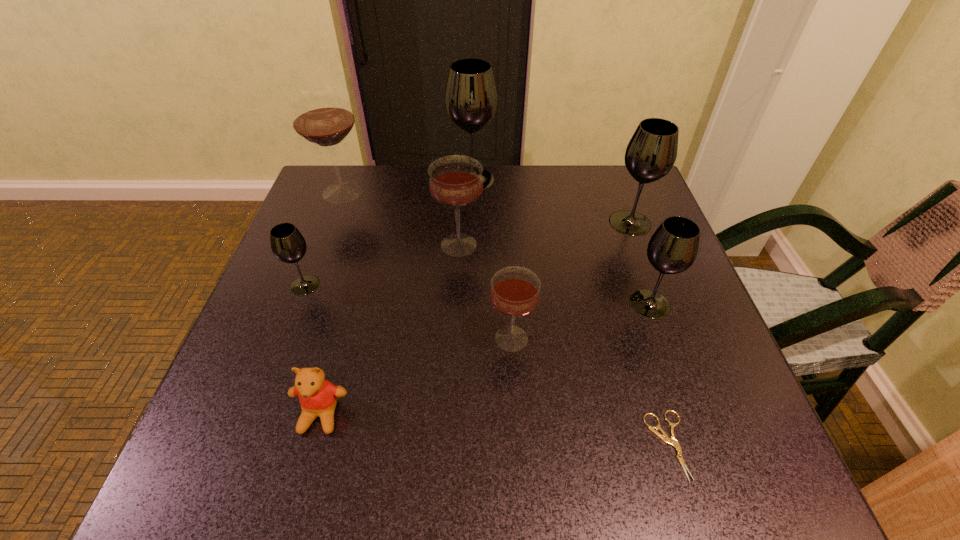
This screenshot has width=960, height=540. What are the coordinates of `object that is at the near right corner` in the screenshot? It's located at click(x=672, y=441).

Locate an element on the screen. The image size is (960, 540). free location at the far edge is located at coordinates (423, 170).

In the image, there is a desktop. Find the location of `vacant space at the near edge`. vacant space at the near edge is located at coordinates (415, 447).

Locate an element on the screen. vacant region at the left edge of the desktop is located at coordinates (238, 380).

Identify the location of vacant space at the right edge of the desktop. The width and height of the screenshot is (960, 540). (672, 293).

This screenshot has height=540, width=960. In order to click on free location at the far left corner of the desktop in this screenshot , I will do `click(354, 201)`.

Image resolution: width=960 pixels, height=540 pixels. In order to click on vacant space at the near right corner of the desktop in this screenshot , I will do `click(708, 481)`.

Where is `free point between the third biggest gray wineglass and the tallest wineglass`? This screenshot has width=960, height=540. free point between the third biggest gray wineglass and the tallest wineglass is located at coordinates (562, 241).

At what (x,y) coordinates should I click in order to perform the action: click on vacant area that lies between the second red wineglass from left to right and the third nearest object. Please return your answer as a coordinate pair (x, y). This screenshot has height=540, width=960. Looking at the image, I should click on (485, 292).

The image size is (960, 540). Identify the location of free spot between the farthest gray wineglass and the leftmost red wineglass. (408, 186).